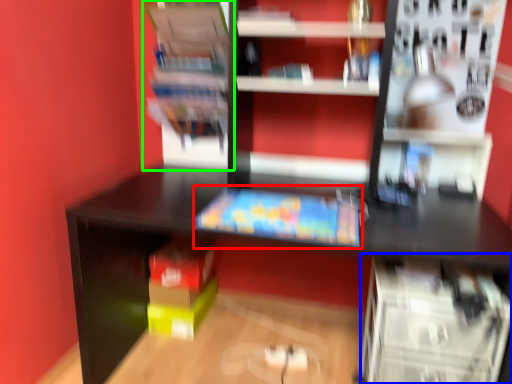
Question: Which object is the farthest from book (highlighted by a red box)? Choose among these: shelf (highlighted by a blue box) or shelf (highlighted by a green box).

Choices:
 (A) shelf
 (B) shelf

Answer: (B)